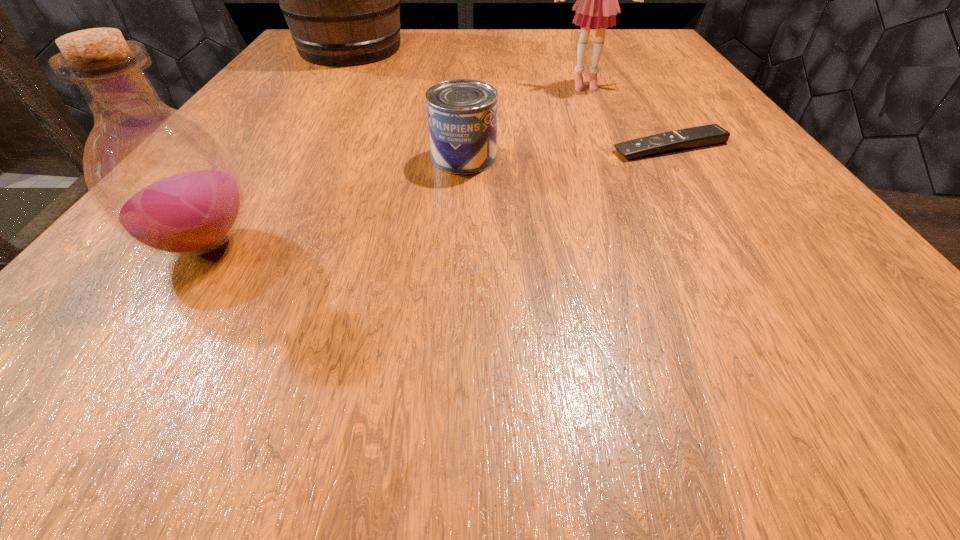
Where is `wine bucket`? The height and width of the screenshot is (540, 960). wine bucket is located at coordinates (341, 0).

The width and height of the screenshot is (960, 540). I want to click on the tallest object, so click(x=341, y=0).

Where is `doll`? doll is located at coordinates (597, 5).

Identify the location of the second tallest object. The height and width of the screenshot is (540, 960). tap(597, 5).

Where is `the nearest object`? Image resolution: width=960 pixels, height=540 pixels. the nearest object is located at coordinates (162, 179).

You are a GUI agent. You are given a task and a screenshot of the screen. Output one action in this format:
    pyautogui.click(x=<x>, y=<y>)
    Task: Click on the third shortest object
    
    Given the screenshot: What is the action you would take?
    pyautogui.click(x=162, y=179)

What are the coordinates of `the second shortest object` in the screenshot? It's located at (462, 114).

Identify the location of the third object from left to right. The width and height of the screenshot is (960, 540). pos(462,114).

Where is `the shortest object`? the shortest object is located at coordinates (712, 134).

Locate an element on the screen. The height and width of the screenshot is (540, 960). blank area located on the right of the tallest object is located at coordinates (540, 49).